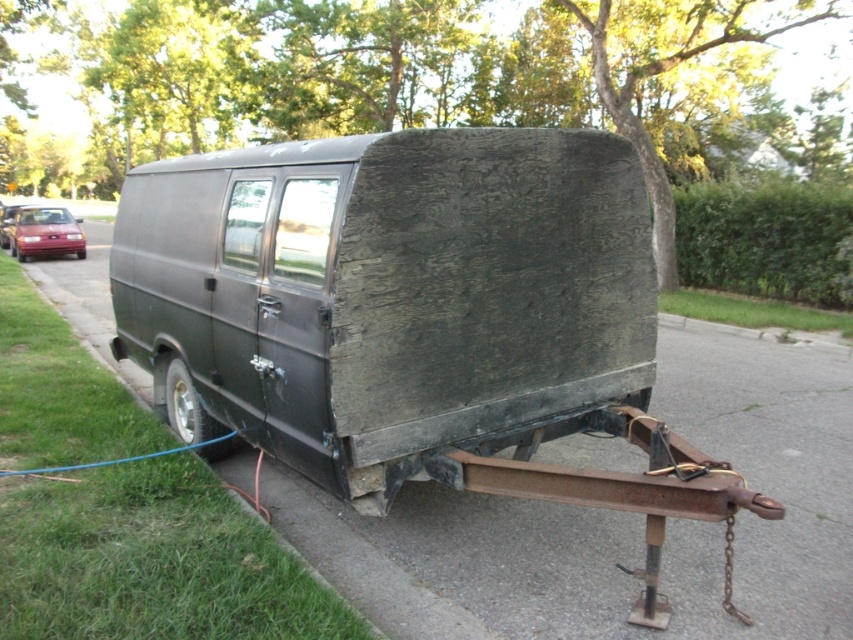
Question: Is matte black van at center to the right of shiny red car at left from the viewer's perspective?

Choices:
 (A) yes
 (B) no

Answer: (A)

Question: Can you confirm if matte black van at center is positioned to the right of shiny red car at left?

Choices:
 (A) yes
 (B) no

Answer: (A)

Question: Which point appears farthest from the camera in this image?

Choices:
 (A) (38, 250)
 (B) (407, 275)

Answer: (A)

Question: Among these points, which one is farthest from the camera?

Choices:
 (A) click(x=322, y=358)
 (B) click(x=9, y=227)

Answer: (B)

Question: Is matte black van at center to the right of shiny red car at left from the viewer's perspective?

Choices:
 (A) yes
 (B) no

Answer: (A)

Question: Which point is closer to the camera?

Choices:
 (A) matte black van at center
 (B) shiny red car at left

Answer: (A)